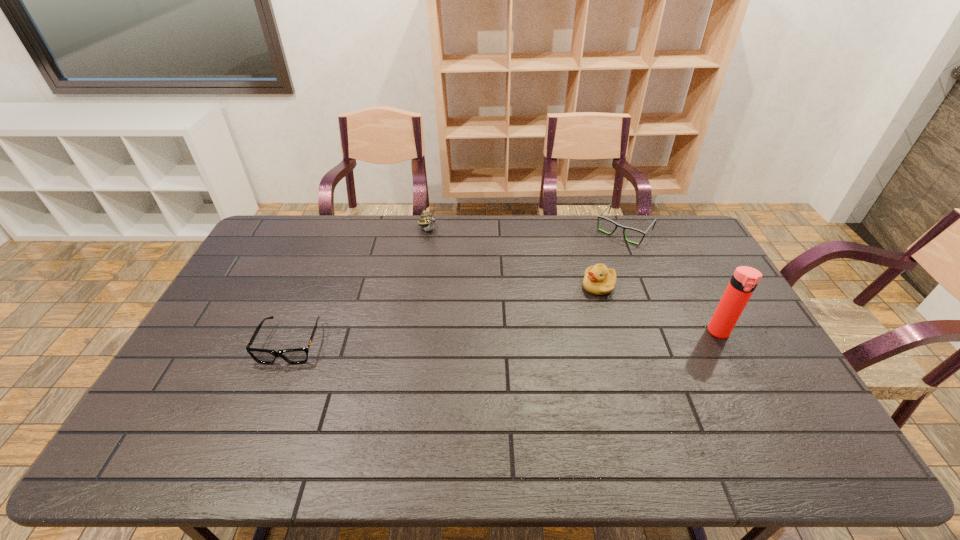
You are a GUI agent. You are given a task and a screenshot of the screen. Output one action in this format:
    pyautogui.click(x=<x>, y=<y>)
    Task: Click on the object that stands as the third closest to the third tallest object
    
    Given the screenshot: What is the action you would take?
    pyautogui.click(x=427, y=221)

At what (x,y) coordinates should I click in order to perform the action: click on the fourth closest object to the rightmost object. Please return your answer as a coordinate pair (x, y). The image size is (960, 540). Looking at the image, I should click on (297, 355).

Find the location of a particular element. Image resolution: width=960 pixels, height=540 pixels. free space that satisfies the following two spatial constraints: 1. on the front side of the rightmost object; 2. on the right side of the second object from left to right is located at coordinates (413, 332).

Image resolution: width=960 pixels, height=540 pixels. I want to click on vacant space that satisfies the following two spatial constraints: 1. on the front side of the third farthest object; 2. on the right side of the fourth object from right to left, so click(420, 286).